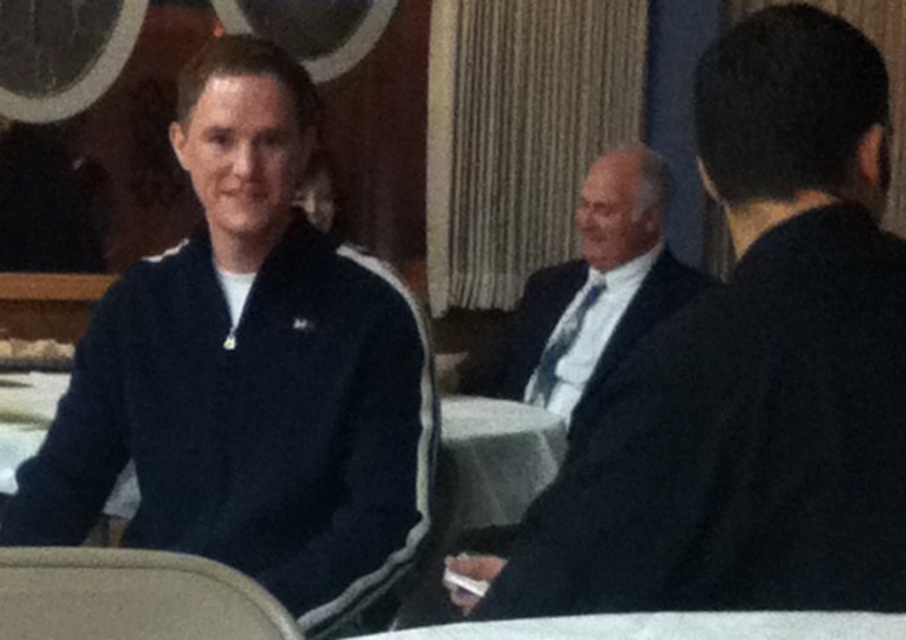
Is matte black jacket at center positioned in front of beige fabric chair at lower left?

Answer: No, it is behind beige fabric chair at lower left.

Which is in front, point (479, 557) or point (124, 632)?

Positioned in front is point (124, 632).

This screenshot has width=906, height=640. In order to click on matte black jacket at center in this screenshot , I will do `click(752, 369)`.

Is point (84, 442) closer to camera compared to point (142, 621)?

No, (84, 442) is further to viewer.

Does navy blue jacket at left have a larger size compared to beige fabric chair at lower left?

Correct, navy blue jacket at left is larger in size than beige fabric chair at lower left.

Between point (427, 512) and point (84, 572), which one is positioned behind?

The point (427, 512) is behind.

Locate an element on the screen. The height and width of the screenshot is (640, 906). navy blue jacket at left is located at coordinates click(x=249, y=372).

Who is positioned more to the left, matte black jacket at center or navy blue jacket at left?

navy blue jacket at left is more to the left.

Between matte black jacket at center and navy blue jacket at left, which one has less height?

Standing shorter between the two is matte black jacket at center.

Find the location of a particular element. This screenshot has height=640, width=906. matte black jacket at center is located at coordinates (752, 369).